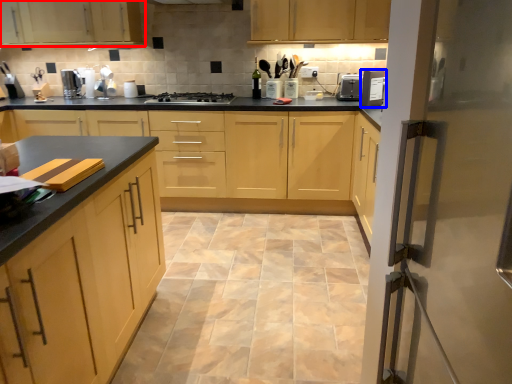
Question: Which point is closer to the camera, cabinetry (highlighted by a red box) or home appliance (highlighted by a blue box)?

Choices:
 (A) cabinetry
 (B) home appliance

Answer: (B)